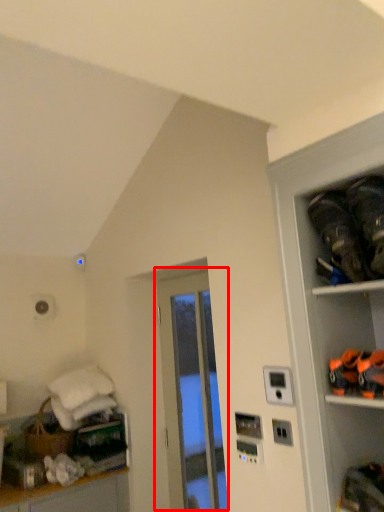
Question: From the image's perspective, considering the relative positions of door (annotated by the red box) and shelf in the image provided, where is door (annotated by the red box) located with respect to the staircase?

Choices:
 (A) above
 (B) below

Answer: (B)